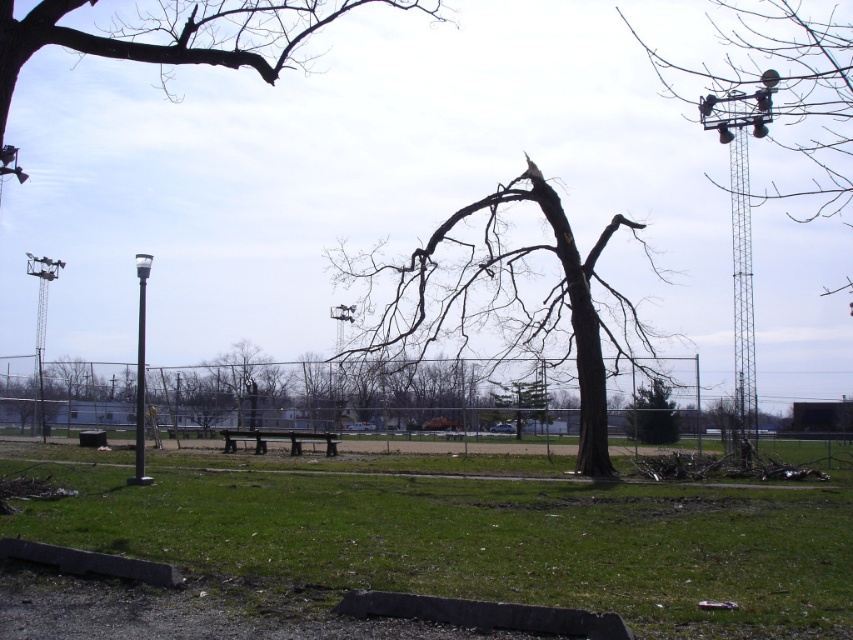
Question: Does green grass at center lie in front of brown wooden bench at center?

Choices:
 (A) no
 (B) yes

Answer: (B)

Question: Is green grass at center closer to the viewer compared to dark brown bark tree at center?

Choices:
 (A) yes
 (B) no

Answer: (A)

Question: Which point is closer to the camera?

Choices:
 (A) (274, 433)
 (B) (839, 93)

Answer: (A)

Question: Which object is positioned farthest from the dark brown bark tree at center?

Choices:
 (A) metallic gray tower at upper right
 (B) green grass at center
 (C) green leafy tree at center
 (D) brown wooden bench at center

Answer: (A)

Question: Which object is positioned farthest from the metallic gray tower at upper right?

Choices:
 (A) green grass at center
 (B) brown wooden bench at center
 (C) dark brown bark tree at center
 (D) green leafy tree at center

Answer: (B)

Question: Is the position of green grass at center more distant than that of brown wooden bench at center?

Choices:
 (A) no
 (B) yes

Answer: (A)